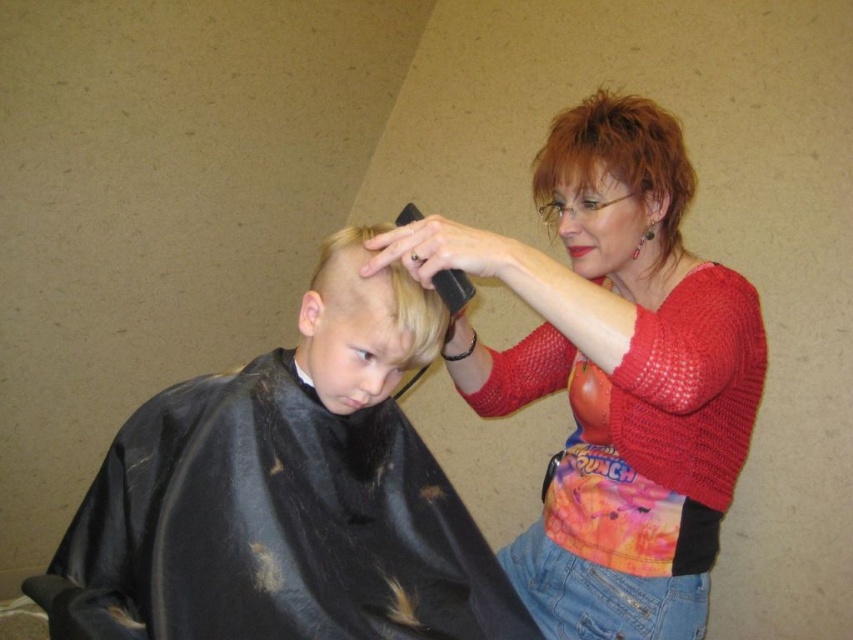
Question: Among these objects, which one is nearest to the camera?

Choices:
 (A) blonde hair at center
 (B) shiny black cape at lower left
 (C) shiny red hair at upper right
 (D) red knit sweater at upper right

Answer: (D)

Question: Estimate the real-world distances between objects in this image. Which object is farther from the red knit sweater at upper right?

Choices:
 (A) shiny red hair at upper right
 (B) shiny black cape at lower left
 (C) blonde hair at center

Answer: (C)

Question: Does red knit sweater at upper right appear under blonde hair at center?

Choices:
 (A) no
 (B) yes

Answer: (B)

Question: Which of the following is the farthest from the observer?

Choices:
 (A) (366, 326)
 (B) (676, 227)

Answer: (B)

Question: Does shiny red hair at upper right come behind blonde hair at center?

Choices:
 (A) no
 (B) yes

Answer: (B)

Question: Is shiny black cape at lower left bigger than shiny red hair at upper right?

Choices:
 (A) no
 (B) yes

Answer: (B)